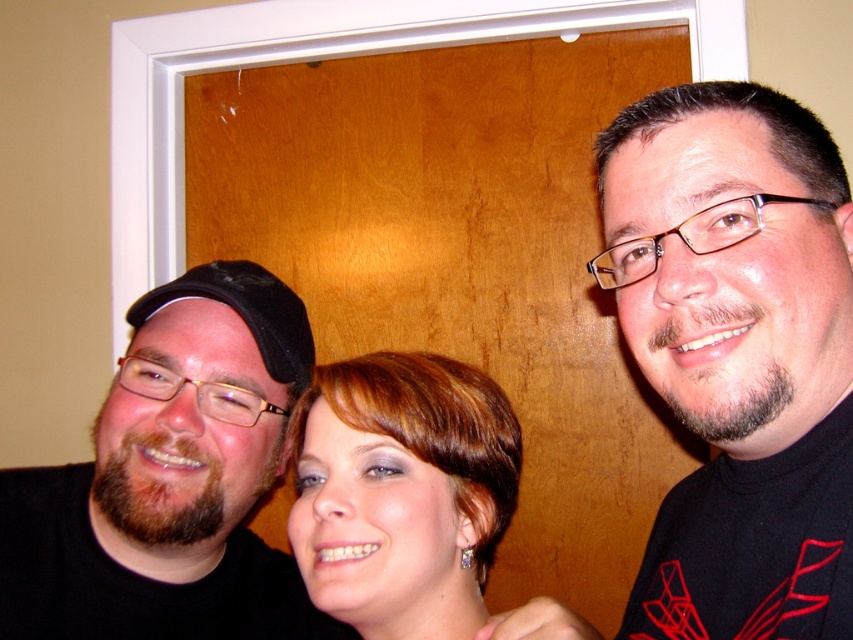
You are taking a photo of the three people in the scene. Which object, the shiny brown hair at center or the black fabric baseball cap at left, will appear larger in the photo?

The shiny brown hair at center will appear larger in the photo because it is closer to the viewer than the black fabric baseball cap at left.

In the scene shown: You are taking a photo of three people in a cozy room with a wooden door. You notice the matte black cap at left and the shiny brown hair at center. Which object is positioned more to the left?

The matte black cap at left is positioned more to the left than the shiny brown hair at center.

You are standing in front of the three people in the image. There are two points marked on the image. One is at coordinate point (721, 499) and the other is at point (498, 504). Which of these two points is nearer to you?

Point (721, 499) is closer to the viewer than point (498, 504).